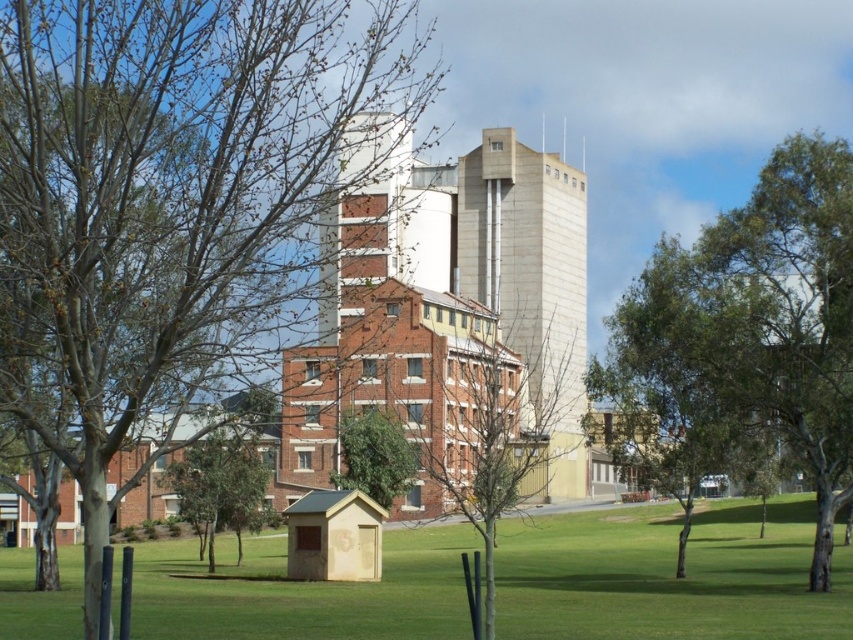
Can you confirm if green leafy tree at upper center is taller than bare branches at center?

Yes, green leafy tree at upper center is taller than bare branches at center.

Which of these two, green leafy tree at upper center or bare branches at center, stands taller?

green leafy tree at upper center

This screenshot has width=853, height=640. I want to click on green leafy tree at upper center, so click(x=752, y=332).

Does point (772, 566) come closer to viewer compared to point (461, 348)?

Yes, point (772, 566) is in front of point (461, 348).

Is point (204, 602) less distant than point (521, 464)?

That is False.

This screenshot has width=853, height=640. Identify the location of wooden mailbox at center. (669, 576).

Is green leafy tree at upper center bigger than green leafy tree at center?

Yes, green leafy tree at upper center is bigger than green leafy tree at center.

Is point (809, 236) positioned behind point (386, 436)?

No.

Measure the distance between green leafy tree at upper center and camera.

green leafy tree at upper center is 276.52 feet away from camera.

Where is `green leafy tree at upper center`? This screenshot has height=640, width=853. green leafy tree at upper center is located at coordinates (752, 332).